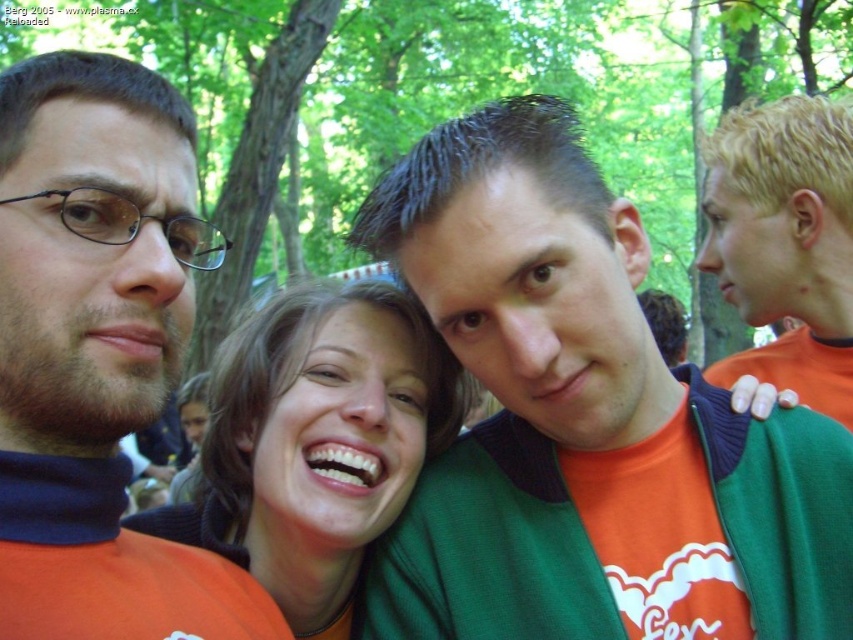
Question: Among these objects, which one is farthest from the camera?

Choices:
 (A) matte orange shirt at center
 (B) blonde hair at right

Answer: (B)

Question: Which object is closer to the camera taking this photo?

Choices:
 (A) matte orange turtleneck at left
 (B) matte orange shirt at center

Answer: (A)

Question: Can you confirm if matte orange shirt at center is smaller than blonde hair at right?

Choices:
 (A) yes
 (B) no

Answer: (A)

Question: Is matte orange shirt at center wider than blonde hair at right?

Choices:
 (A) no
 (B) yes

Answer: (B)

Question: Does orange fabric shirt at center appear on the left side of matte orange turtleneck at left?

Choices:
 (A) no
 (B) yes

Answer: (A)

Question: Estimate the real-world distances between objects in this image. Which object is closer to the matte orange shirt at center?

Choices:
 (A) orange fabric shirt at center
 (B) matte orange turtleneck at left

Answer: (A)